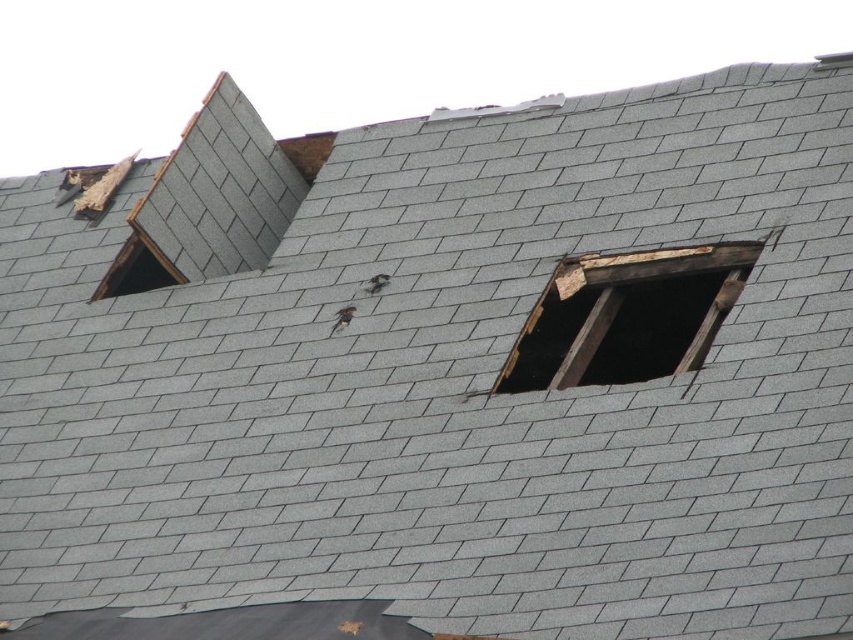
Question: Which point is closer to the camera?

Choices:
 (A) weathered wood window at upper right
 (B) transparent glass window at upper left

Answer: (A)

Question: In this image, where is weathered wood window at upper right located relative to transparent glass window at upper left?

Choices:
 (A) above
 (B) below

Answer: (B)

Question: Does weathered wood window at upper right appear on the left side of transparent glass window at upper left?

Choices:
 (A) yes
 (B) no

Answer: (B)

Question: Where is weathered wood window at upper right located in relation to transparent glass window at upper left in the image?

Choices:
 (A) right
 (B) left

Answer: (A)

Question: Which point appears closest to the camera in this image?

Choices:
 (A) (590, 304)
 (B) (161, 275)

Answer: (A)